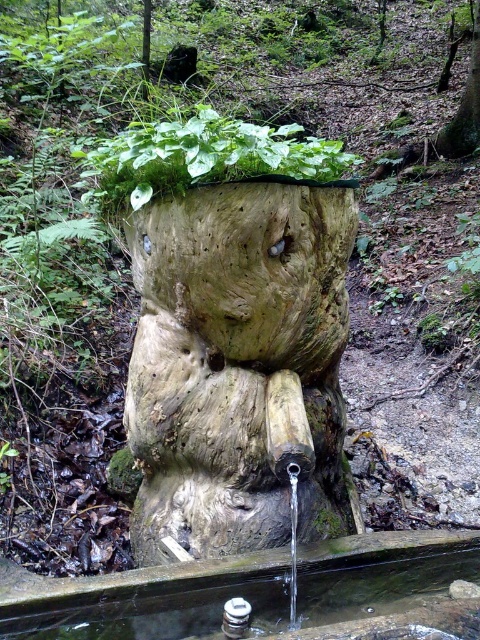
Question: In this image, where is clear glass water at lower center located relative to rough bark tree trunk at upper center?

Choices:
 (A) left
 (B) right

Answer: (A)

Question: Is natural wood fountain at center to the right of rough bark tree trunk at upper center from the viewer's perspective?

Choices:
 (A) no
 (B) yes

Answer: (A)

Question: Does clear glass water at lower center lie behind rough bark tree trunk at upper center?

Choices:
 (A) yes
 (B) no

Answer: (B)

Question: Which object appears closest to the camera in this image?

Choices:
 (A) natural wood fountain at center
 (B) rough bark tree trunk at upper center
 (C) clear glass water at lower center

Answer: (C)

Question: Which point is farther from the camera taking this photo?

Choices:
 (A) (216, 516)
 (B) (391, 625)

Answer: (A)

Question: Which point is farther to the camera?

Choices:
 (A) clear glass water at lower center
 (B) rough bark tree trunk at upper center

Answer: (B)